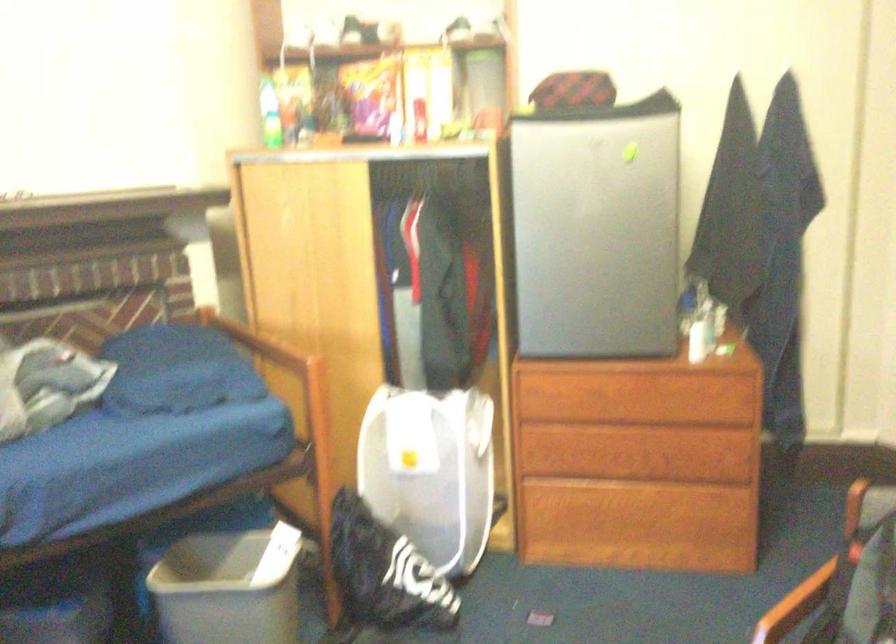
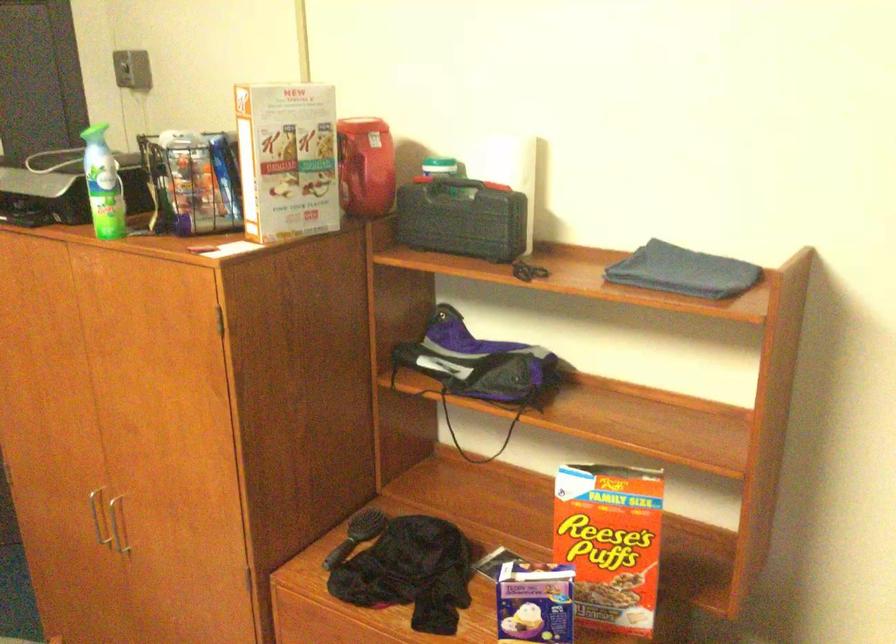
Question: The camera is either moving clockwise (left) or counter-clockwise (right) around the object. The first image is from the beginning of the video and the second image is from the end. Is the camera moving left or right when shooting the video?

Choices:
 (A) Left
 (B) Right

Answer: (A)